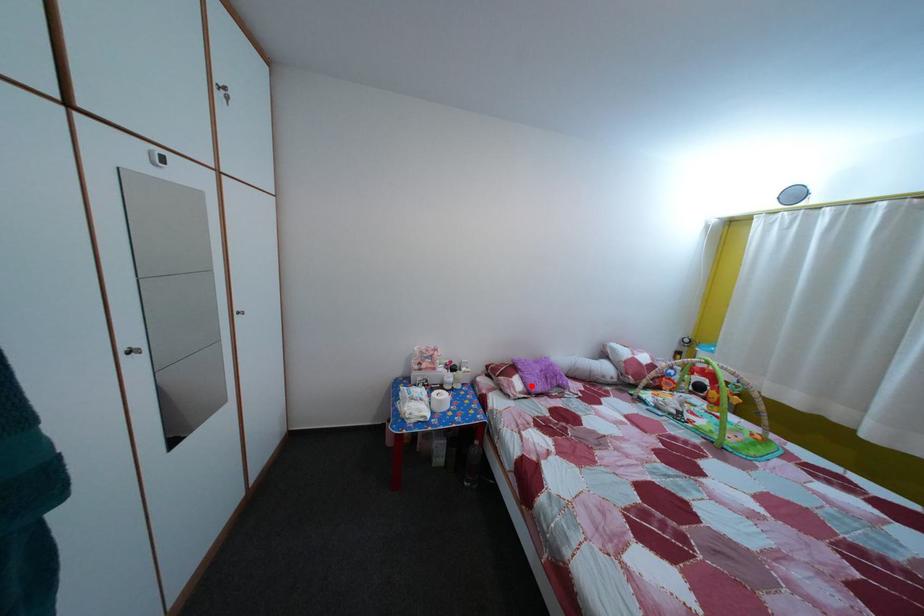
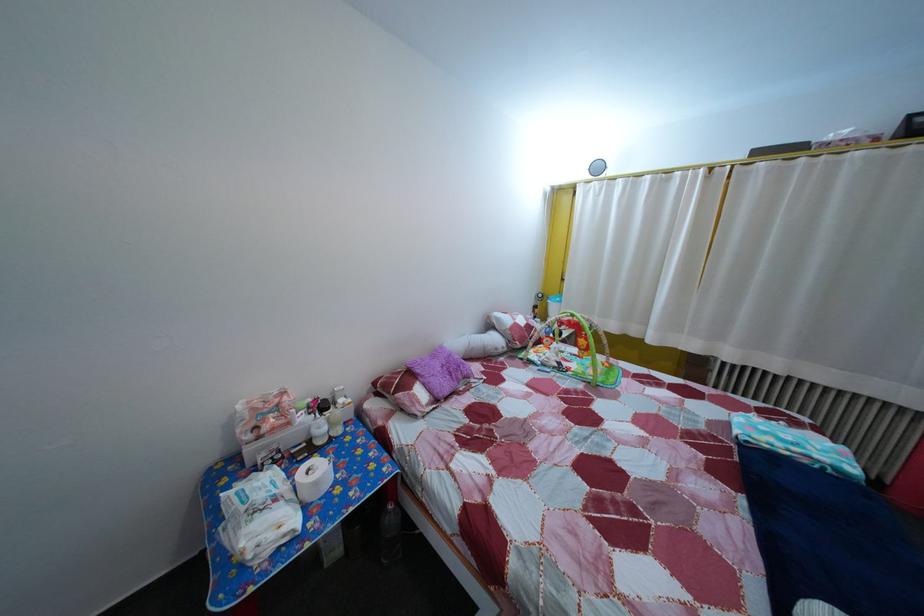
The point at the highlighted location is marked in the first image. Where is the corresponding point in the second image?

(433, 392)